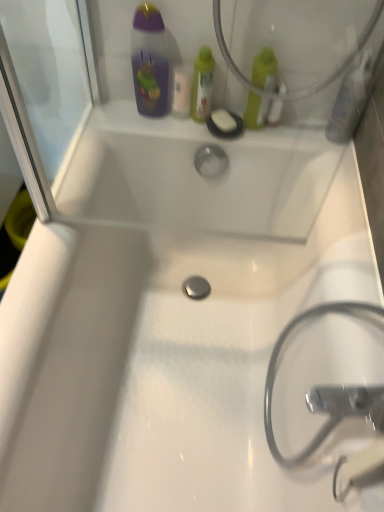
At what (x,y) coordinates should I click in order to perform the action: click on free space between white matte soap at upper center and translucent plastic mouthwash at upper right, the 5th mouthwash positioned from the left. Please return your answer as a coordinate pair (x, y). The image size is (384, 512). Looking at the image, I should click on (299, 131).